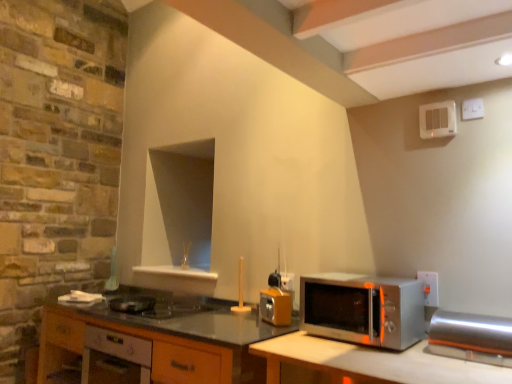
Question: From a real-world perspective, is wooden cabinet at lower left, positioned as the first cabinetry in right-to-left order, physically below white plastic electric outlet at right, which is the second electric outlet in back-to-front order?

Choices:
 (A) no
 (B) yes

Answer: (B)

Question: Can you confirm if wooden cabinet at lower left, placed as the second cabinetry when sorted from left to right, is thinner than white plastic electric outlet at right, the first electric outlet from the front?

Choices:
 (A) yes
 (B) no

Answer: (B)

Question: Considering the relative sizes of wooden cabinet at lower left, placed as the second cabinetry when sorted from left to right, and white plastic electric outlet at right, the first electric outlet from the front, in the image provided, is wooden cabinet at lower left, placed as the second cabinetry when sorted from left to right, taller than white plastic electric outlet at right, the first electric outlet from the front,?

Choices:
 (A) yes
 (B) no

Answer: (A)

Question: Is white plastic electric outlet at right, the first electric outlet from the front, surrounded by wooden cabinet at lower left, positioned as the first cabinetry in right-to-left order?

Choices:
 (A) no
 (B) yes

Answer: (A)

Question: From a real-world perspective, is wooden cabinet at lower left, placed as the second cabinetry when sorted from left to right, positioned over white plastic electric outlet at right, which is the second electric outlet in back-to-front order, based on gravity?

Choices:
 (A) yes
 (B) no

Answer: (B)

Question: From the image's perspective, relative to white plastic electric outlet at right, the first electric outlet from the left, is satin silver toaster oven at right, the first appliance from the front, above or below?

Choices:
 (A) below
 (B) above

Answer: (A)

Question: Is point (486, 321) positioned closer to the camera than point (285, 271)?

Choices:
 (A) closer
 (B) farther

Answer: (A)

Question: Considering the positions of satin silver toaster oven at right, the first appliance in the right-to-left sequence, and white plastic electric outlet at right, marked as the 2th electric outlet in a front-to-back arrangement, in the image, is satin silver toaster oven at right, the first appliance in the right-to-left sequence, wider or thinner than white plastic electric outlet at right, marked as the 2th electric outlet in a front-to-back arrangement,?

Choices:
 (A) thin
 (B) wide

Answer: (B)

Question: Based on their sizes in the image, would you say satin silver toaster oven at right, the first appliance in the right-to-left sequence, is bigger or smaller than white plastic electric outlet at right, arranged as the second electric outlet when viewed from the right?

Choices:
 (A) big
 (B) small

Answer: (A)

Question: Based on their sizes in the image, would you say white plastic exhaust fan at upper right, marked as the second appliance in a right-to-left arrangement, is bigger or smaller than white plastic electric outlet at right, the first electric outlet positioned from the right?

Choices:
 (A) small
 (B) big

Answer: (B)

Question: Visually, is white plastic exhaust fan at upper right, the first appliance from the top, positioned to the left or to the right of white plastic electric outlet at right, which is counted as the second electric outlet, starting from the left?

Choices:
 (A) left
 (B) right

Answer: (B)

Question: Considering the positions of white plastic exhaust fan at upper right, acting as the 2th appliance starting from the left, and white plastic electric outlet at right, the first electric outlet positioned from the right, in the image, is white plastic exhaust fan at upper right, acting as the 2th appliance starting from the left, wider or thinner than white plastic electric outlet at right, the first electric outlet positioned from the right,?

Choices:
 (A) wide
 (B) thin

Answer: (A)

Question: Is white plastic exhaust fan at upper right, the 2th appliance viewed from the back, situated inside white plastic electric outlet at right, which is counted as the second electric outlet, starting from the left, or outside?

Choices:
 (A) inside
 (B) outside

Answer: (B)

Question: In terms of height, does wooden cabinet at lower left, placed as the second cabinetry when sorted from left to right, look taller or shorter compared to white plastic electric outlet at right, marked as the 2th electric outlet in a front-to-back arrangement?

Choices:
 (A) short
 (B) tall

Answer: (B)

Question: Looking at the image, does wooden cabinet at lower left, placed as the second cabinetry when sorted from left to right, seem bigger or smaller compared to white plastic electric outlet at right, the first electric outlet from the left?

Choices:
 (A) big
 (B) small

Answer: (A)